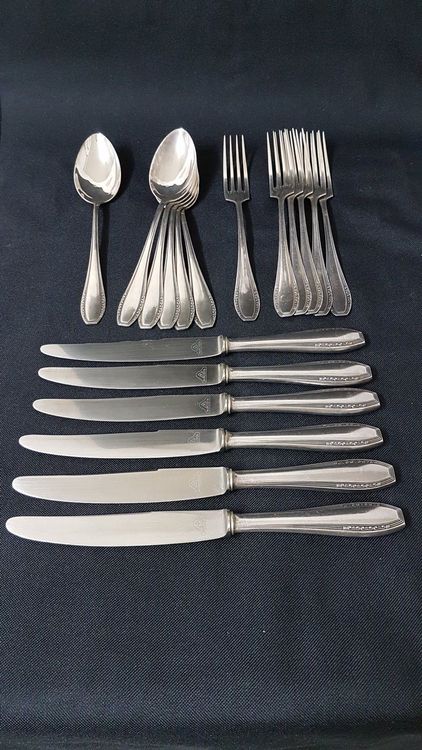
Locate an element on the screen. spoon handles is located at coordinates (94, 290), (134, 294), (150, 300), (170, 302), (184, 304), (199, 306).